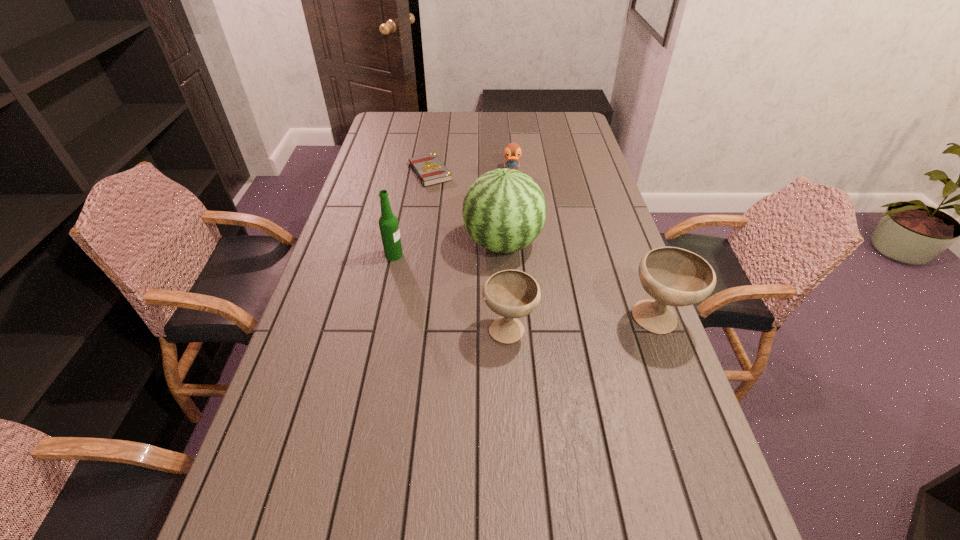
Where is `free spot that satisfies the following two spatial constraints: 1. on the front-facing side of the right chalice; 2. on the right side of the duck`? The image size is (960, 540). free spot that satisfies the following two spatial constraints: 1. on the front-facing side of the right chalice; 2. on the right side of the duck is located at coordinates [x=527, y=320].

You are a GUI agent. You are given a task and a screenshot of the screen. Output one action in this format:
    pyautogui.click(x=<x>, y=<y>)
    Task: Click on the vacant region that satisfies the following two spatial constraints: 1. on the label of the second tallest object; 2. on the right side of the taller chalice
    The image size is (960, 540).
    Given the screenshot: What is the action you would take?
    pyautogui.click(x=380, y=320)

Where is `vacant space that satisfies the following two spatial constraints: 1. on the front side of the shortest object; 2. on the left side of the shorter chalice`? The width and height of the screenshot is (960, 540). vacant space that satisfies the following two spatial constraints: 1. on the front side of the shortest object; 2. on the left side of the shorter chalice is located at coordinates (406, 328).

This screenshot has width=960, height=540. Find the location of `free space that satisfies the following two spatial constraints: 1. on the label of the left chalice; 2. on the right side of the fifth shortest object`. free space that satisfies the following two spatial constraints: 1. on the label of the left chalice; 2. on the right side of the fifth shortest object is located at coordinates (378, 328).

Identify the location of vacant point that satisfies the following two spatial constraints: 1. on the label of the left chalice; 2. on the left side of the beer bottle. The width and height of the screenshot is (960, 540). (378, 328).

Find the location of a particular element. blank area in the image that satisfies the following two spatial constraints: 1. on the front side of the third tallest object; 2. on the right side of the book is located at coordinates [407, 320].